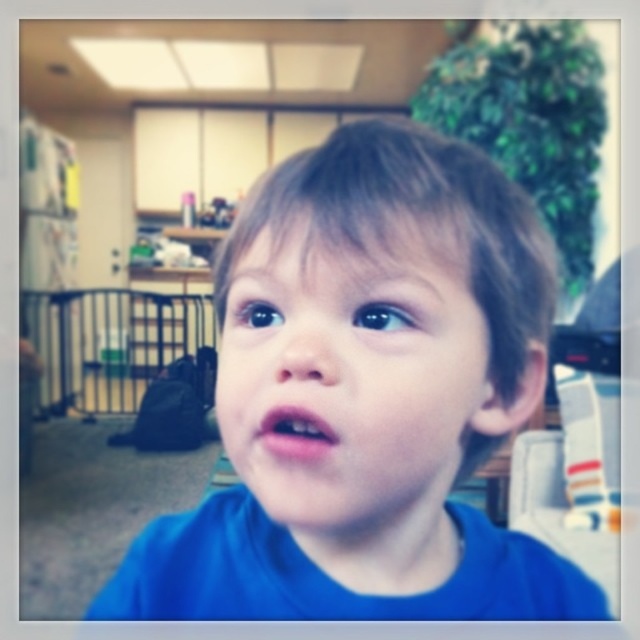
Question: Which of the following is the farthest from the observer?

Choices:
 (A) blue matte shirt at center
 (B) blue matte face at center

Answer: (A)

Question: Estimate the real-world distances between objects in this image. Which object is farther from the blue matte face at center?

Choices:
 (A) blue matte shirt at center
 (B) pink matte lips at center

Answer: (B)

Question: Which point appears farthest from the camera in this image?

Choices:
 (A) (262, 442)
 (B) (412, 273)

Answer: (A)

Question: Where is blue matte shirt at center located in relation to pink matte lips at center in the image?

Choices:
 (A) right
 (B) left

Answer: (A)

Question: Is blue matte face at center to the left of pink matte lips at center from the viewer's perspective?

Choices:
 (A) no
 (B) yes

Answer: (A)

Question: In this image, where is blue matte shirt at center located relative to pink matte lips at center?

Choices:
 (A) right
 (B) left

Answer: (A)